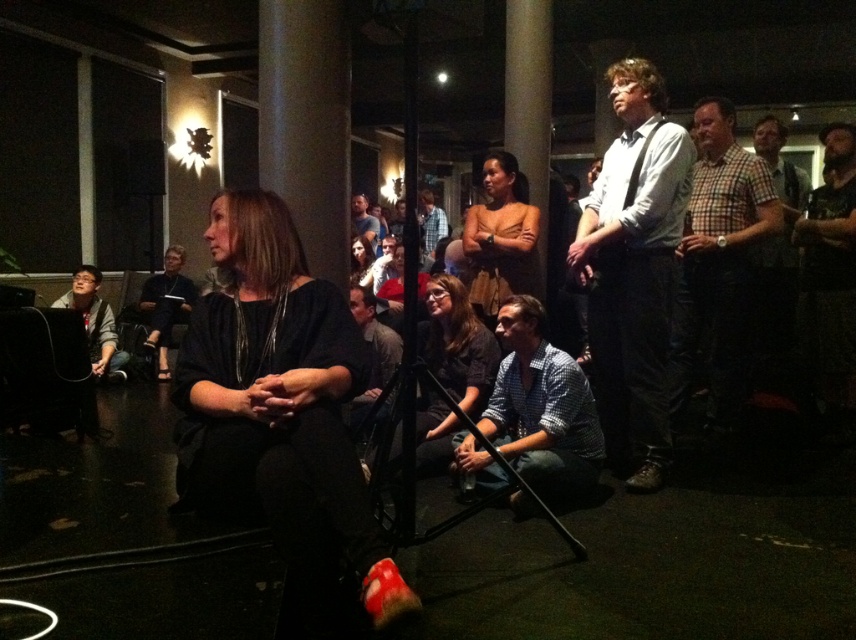
Question: Which object is positioned closest to the brown leather purse at center?

Choices:
 (A) blue shirt at center
 (B) dark blue shirt at center

Answer: (A)

Question: Observing the image, what is the correct spatial positioning of white shirt with black suspenders at center in reference to brown leather purse at center?

Choices:
 (A) left
 (B) right

Answer: (B)

Question: Based on their relative distances, which object is farther from the dark gray sweater at center?

Choices:
 (A) blue plaid shirt at center
 (B) gray fabric jacket at left
 (C) gray fabric shirt at center

Answer: (A)

Question: Can you confirm if blue shirt at center is positioned to the left of matte black shirt at center?

Choices:
 (A) no
 (B) yes

Answer: (B)

Question: Can you confirm if brown leather purse at center is wider than dark blue shirt at center?

Choices:
 (A) yes
 (B) no

Answer: (B)

Question: Which point is farther to the camera?

Choices:
 (A) white shirt with black suspenders at center
 (B) checkered fabric shirt at right

Answer: (B)